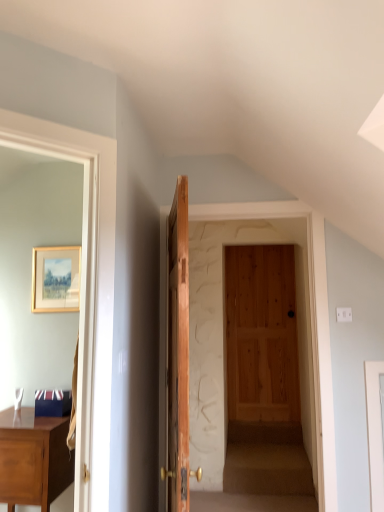
Describe the element at coordinates (177, 356) in the screenshot. The height and width of the screenshot is (512, 384). I see `wooden door at center` at that location.

In order to face wooden picture frame at upper left, should I rotate leftwards or rightwards?

Turn left approximately 17.460 degrees to face it.

The height and width of the screenshot is (512, 384). Describe the element at coordinates (33, 458) in the screenshot. I see `matte brown desk at left` at that location.

You are a GUI agent. You are given a task and a screenshot of the screen. Output one action in this format:
    pyautogui.click(x=<x>, y=<y>)
    Task: Click on the wooden door at center
    The image size is (384, 512).
    Given the screenshot: What is the action you would take?
    pyautogui.click(x=177, y=356)

From a real-world perspective, does wooden picture frame at upper left stand above wooden door at center?

Yes, from a real-world perspective, wooden picture frame at upper left is over wooden door at center

Consider the image. Considering the relative sizes of wooden picture frame at upper left and wooden door at center in the image provided, is wooden picture frame at upper left smaller than wooden door at center?

Indeed, wooden picture frame at upper left has a smaller size compared to wooden door at center.

This screenshot has width=384, height=512. I want to click on door directly beneath the wooden picture frame at upper left (from a real-world perspective), so click(x=177, y=356).

Which object is closer to the camera taking this photo, wooden picture frame at upper left or wooden door at center?

Positioned in front is wooden door at center.

What's the angular difference between wooden door at center and matte brown desk at left's facing directions?

The angle between the facing direction of wooden door at center and the facing direction of matte brown desk at left is 104 degrees.

Does wooden door at center come behind matte brown desk at left?

No.

From the picture: Considering the positions of objects wooden door at center and matte brown desk at left in the image provided, who is more to the right, wooden door at center or matte brown desk at left?

wooden door at center.

Between point (183, 234) and point (15, 441), which one is positioned in front?

The point (15, 441) is closer to the camera.

Is wooden door at center to the right of wooden picture frame at upper left from the viewer's perspective?

Yes, wooden door at center is to the right of wooden picture frame at upper left.

From the image's perspective, which one is positioned higher, wooden door at center or wooden picture frame at upper left?

wooden picture frame at upper left is shown above in the image.

Do you think wooden door at center is within wooden picture frame at upper left, or outside of it?

wooden door at center is outside wooden picture frame at upper left.

In the image, is wooden door at center positioned in front of or behind wooden picture frame at upper left?

wooden door at center is in front of wooden picture frame at upper left.

Is point (47, 489) positioned before point (67, 302)?

That is True.

In the image, is matte brown desk at left on the left side or the right side of wooden picture frame at upper left?

matte brown desk at left is positioned on wooden picture frame at upper left's left side.

Is matte brown desk at left positioned with its back to wooden picture frame at upper left?

No.

Where is `desk below the wooden door at center (from the image's perspective)`? The image size is (384, 512). desk below the wooden door at center (from the image's perspective) is located at coordinates (33, 458).

Is matte brown desk at left in front of or behind wooden door at center in the image?

Visually, matte brown desk at left is located behind wooden door at center.

How many degrees apart are the facing directions of matte brown desk at left and wooden door at center?

104 degrees.

Consider the image. Considering the positions of objects matte brown desk at left and wooden door at center in the image provided, who is more to the right, matte brown desk at left or wooden door at center?

Positioned to the right is wooden door at center.

Is wooden picture frame at upper left shorter than matte brown desk at left?

Yes.

Can you confirm if wooden picture frame at upper left is bigger than matte brown desk at left?

Actually, wooden picture frame at upper left might be smaller than matte brown desk at left.

Is the depth of wooden picture frame at upper left greater than that of matte brown desk at left?

Yes, it is.

From the picture: From a real-world perspective, is wooden picture frame at upper left under matte brown desk at left?

No.

The height and width of the screenshot is (512, 384). Identify the location of picture frame that is on the left side of wooden door at center. (56, 279).

Image resolution: width=384 pixels, height=512 pixels. What are the coordinates of `desk below the wooden door at center (from the image's perspective)` in the screenshot? It's located at (33, 458).

From the image, which object appears to be nearer to wooden door at center, wooden picture frame at upper left or matte brown desk at left?

matte brown desk at left.

Which object lies further to the anchor point wooden picture frame at upper left, matte brown desk at left or wooden door at center?

matte brown desk at left.

From the image, which object appears to be nearer to matte brown desk at left, wooden picture frame at upper left or wooden door at center?

wooden door at center is closer to matte brown desk at left.

Estimate the real-world distances between objects in this image. Which object is further from wooden door at center, matte brown desk at left or wooden picture frame at upper left?

wooden picture frame at upper left is positioned further to the anchor wooden door at center.

Based on their spatial positions, is wooden door at center or wooden picture frame at upper left closer to matte brown desk at left?

wooden door at center is positioned closer to the anchor matte brown desk at left.

Which object lies nearer to the anchor point wooden picture frame at upper left, wooden door at center or matte brown desk at left?

Among the two, wooden door at center is located nearer to wooden picture frame at upper left.

Where is `door between wooden picture frame at upper left and matte brown desk at left from top to bottom`? door between wooden picture frame at upper left and matte brown desk at left from top to bottom is located at coordinates (177, 356).